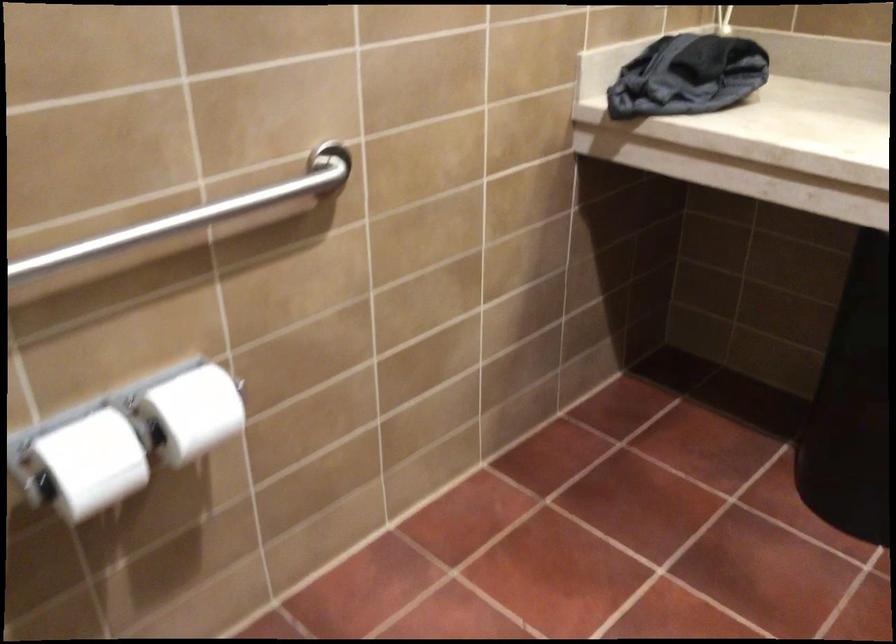
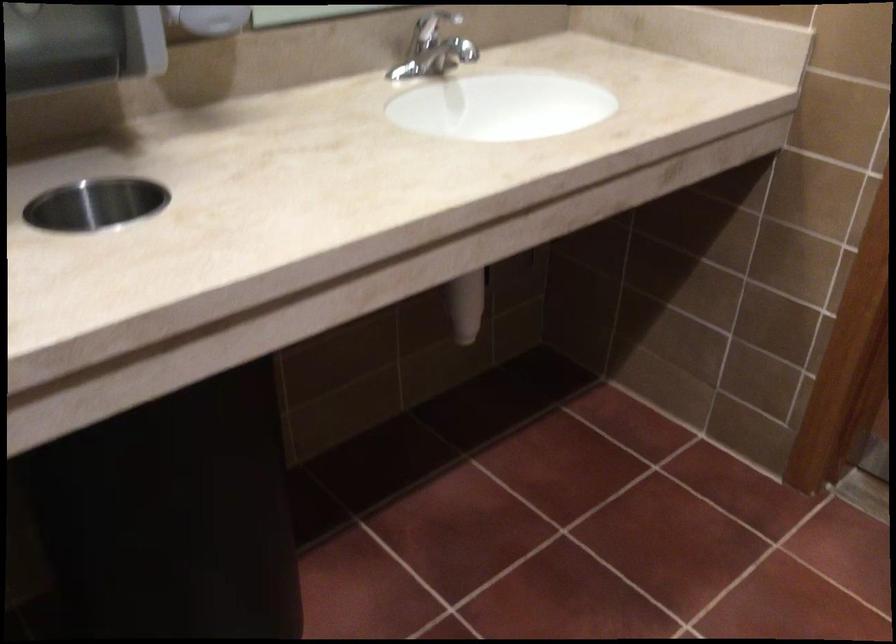
Based on the continuous images, in which direction is the camera rotating?

The camera's rotation is toward right-down.